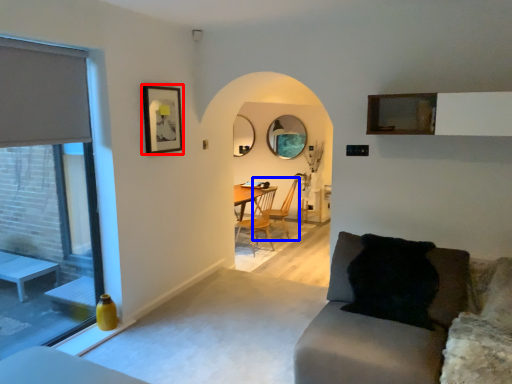
Question: Which object appears closest to the camera in this image, picture frame (highlighted by a red box) or chair (highlighted by a blue box)?

Choices:
 (A) picture frame
 (B) chair

Answer: (A)